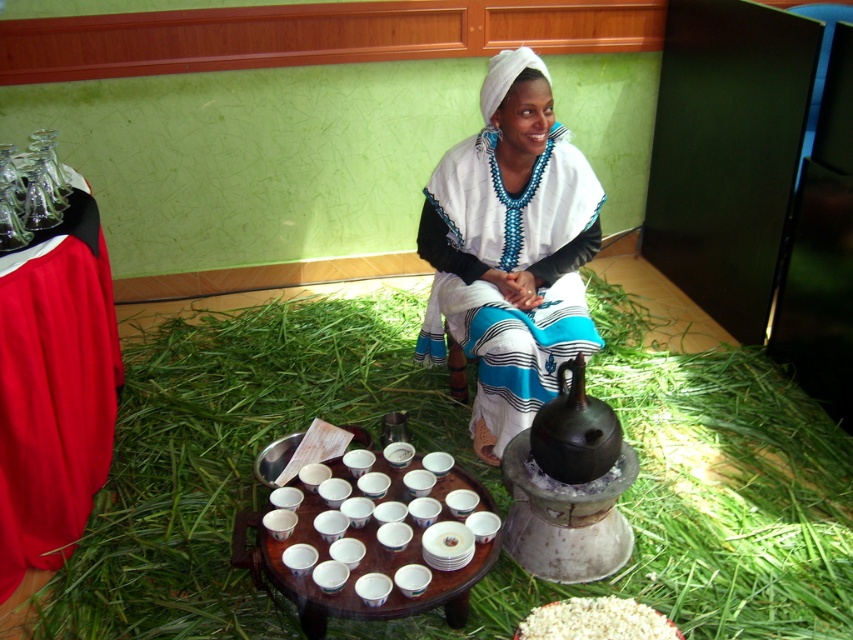
Consider the image. Which is more to the left, white woven cloth at center or wooden table at center?

Positioned to the left is wooden table at center.

Which is behind, point (454, 184) or point (379, 460)?

The point (454, 184) is behind.

This screenshot has width=853, height=640. Find the location of `white woven cloth at center`. white woven cloth at center is located at coordinates (509, 250).

Where is `white woven cloth at center`? white woven cloth at center is located at coordinates (509, 250).

Does green grassy hay at center have a lesser width compared to white matte rice at lower center?

No, green grassy hay at center is not thinner than white matte rice at lower center.

In the scene shown: Measure the distance between point [212,316] and camera.

Point [212,316] and camera are 3.22 meters apart.

Where is `green grassy hay at center`? green grassy hay at center is located at coordinates (233, 456).

Is white woven cloth at center to the right of white matte rice at lower center from the viewer's perspective?

No, white woven cloth at center is not to the right of white matte rice at lower center.

Which is in front, point (431, 177) or point (532, 609)?

Point (532, 609) is more forward.

Locate an element on the screen. white woven cloth at center is located at coordinates (509, 250).